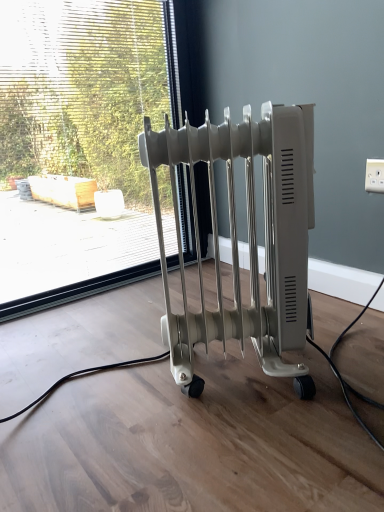
Where is `white plastic radiator at center`? Image resolution: width=384 pixels, height=512 pixels. white plastic radiator at center is located at coordinates (248, 234).

From the image's perspective, relative to white plastic outlet at upper right, is transparent glass window at center above or below?

Based on their image positions, transparent glass window at center is located above white plastic outlet at upper right.

Which of these two, transparent glass window at center or white plastic outlet at upper right, is thinner?

white plastic outlet at upper right is thinner.

Between transparent glass window at center and white plastic outlet at upper right, which one has less height?

Standing shorter between the two is white plastic outlet at upper right.

Is white plastic radiator at center closer to the viewer compared to transparent glass window at center?

That is True.

Is white plastic radiator at center to the left or to the right of transparent glass window at center in the image?

white plastic radiator at center is positioned on transparent glass window at center's right side.

Considering the relative sizes of white plastic radiator at center and transparent glass window at center in the image provided, is white plastic radiator at center thinner than transparent glass window at center?

Incorrect, the width of white plastic radiator at center is not less than that of transparent glass window at center.

Is point (288, 371) less distant than point (75, 187)?

Yes, it is.

From a real-world perspective, is transparent glass window at center below white plastic radiator at center?

No, from a real-world perspective, transparent glass window at center is not below white plastic radiator at center.

In order to click on window above the white plastic radiator at center (from a real-world perspective) in this screenshot , I will do `click(84, 139)`.

Considering the relative sizes of transparent glass window at center and white plastic radiator at center in the image provided, is transparent glass window at center taller than white plastic radiator at center?

Correct, transparent glass window at center is much taller as white plastic radiator at center.

Which is more to the left, white plastic outlet at upper right or transparent glass window at center?

From the viewer's perspective, transparent glass window at center appears more on the left side.

Which object is wider, white plastic outlet at upper right or transparent glass window at center?

transparent glass window at center is wider.

Does white plastic outlet at upper right have a lesser height compared to transparent glass window at center?

Correct, white plastic outlet at upper right is not as tall as transparent glass window at center.

Measure the distance from white plastic outlet at upper right to transparent glass window at center.

1.27 meters.

Based on the photo, is white plastic outlet at upper right closer to camera compared to white plastic radiator at center?

No, white plastic outlet at upper right is behind white plastic radiator at center.

From the image's perspective, is white plastic outlet at upper right on white plastic radiator at center?

Yes.

Does white plastic outlet at upper right have a larger size compared to white plastic radiator at center?

Actually, white plastic outlet at upper right might be smaller than white plastic radiator at center.

Is white plastic outlet at upper right turned away from white plastic radiator at center?

That's not correct — white plastic outlet at upper right is not looking away from white plastic radiator at center.

Does white plastic radiator at center have a lesser height compared to white plastic outlet at upper right?

No.

Looking at their sizes, would you say white plastic radiator at center is wider or thinner than white plastic outlet at upper right?

In the image, white plastic radiator at center appears to be wider than white plastic outlet at upper right.

From a real-world perspective, is white plastic radiator at center positioned over white plastic outlet at upper right based on gravity?

Actually, white plastic radiator at center is physically below white plastic outlet at upper right in the real world.

Is white plastic outlet at upper right at the back of white plastic radiator at center?

No, white plastic radiator at center's orientation is not away from white plastic outlet at upper right.

Locate an element on the screen. The height and width of the screenshot is (512, 384). window located above the white plastic outlet at upper right (from the image's perspective) is located at coordinates (84, 139).

The width and height of the screenshot is (384, 512). I want to click on window on the left side of white plastic radiator at center, so click(x=84, y=139).

Considering their positions, is white plastic radiator at center positioned closer to transparent glass window at center than white plastic outlet at upper right?

Based on the image, white plastic radiator at center appears to be nearer to transparent glass window at center.

Which object lies nearer to the anchor point white plastic radiator at center, white plastic outlet at upper right or transparent glass window at center?

The object closer to white plastic radiator at center is white plastic outlet at upper right.

From the image, which object appears to be farther from transparent glass window at center, white plastic outlet at upper right or white plastic radiator at center?

white plastic outlet at upper right lies further to transparent glass window at center than the other object.

Considering their positions, is transparent glass window at center positioned further to white plastic radiator at center than white plastic outlet at upper right?

transparent glass window at center lies further to white plastic radiator at center than the other object.

Looking at the image, which one is located further to white plastic outlet at upper right, transparent glass window at center or white plastic radiator at center?

Among the two, transparent glass window at center is located further to white plastic outlet at upper right.

Considering their positions, is white plastic radiator at center positioned further to white plastic outlet at upper right than transparent glass window at center?

transparent glass window at center is further to white plastic outlet at upper right.

Locate an element on the screen. bath heater situated between transparent glass window at center and white plastic outlet at upper right from left to right is located at coordinates (248, 234).